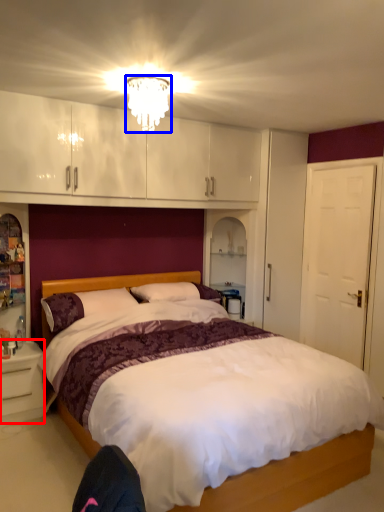
Question: Which object is closer to the camera taking this photo, nightstand (highlighted by a red box) or light fixture (highlighted by a blue box)?

Choices:
 (A) nightstand
 (B) light fixture

Answer: (B)